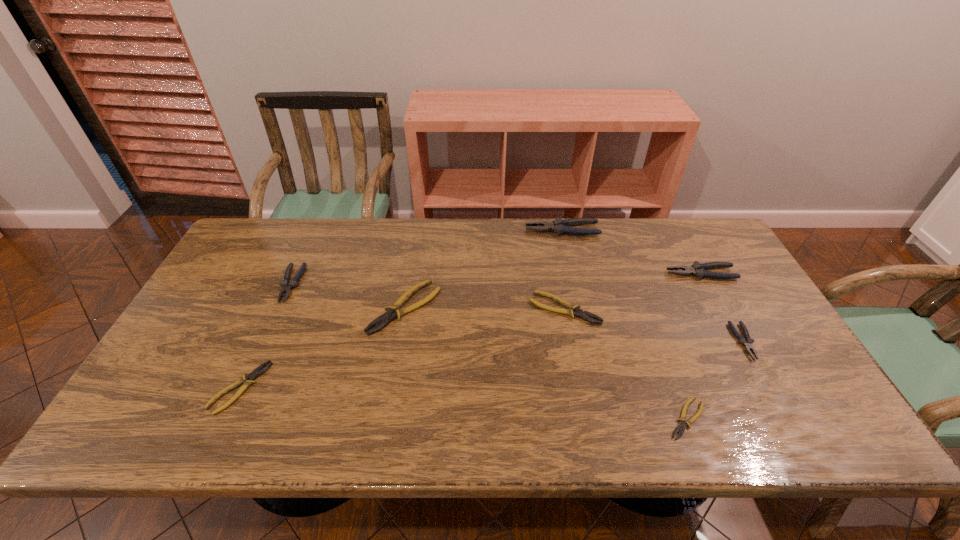
You are a GUI agent. You are given a task and a screenshot of the screen. Output one action in this format:
    pyautogui.click(x=<x>, y=<y>)
    Task: Click on the blank area at the far right corner
    The width and height of the screenshot is (960, 540).
    Given the screenshot: What is the action you would take?
    pyautogui.click(x=700, y=251)

Where is `free space that is in between the second yellow pliers from left to right and the leftmost gray pliers`? free space that is in between the second yellow pliers from left to right and the leftmost gray pliers is located at coordinates (348, 296).

The height and width of the screenshot is (540, 960). Find the location of `empty space between the second smallest gray pliers and the seventh shortest object`. empty space between the second smallest gray pliers and the seventh shortest object is located at coordinates (496, 279).

Identify the location of empty space between the third object from left to right and the seventh shortest object. The width and height of the screenshot is (960, 540). (553, 291).

Where is `vacant space that is in between the third smallest yellow pliers and the third yellow pliers from right to left`? vacant space that is in between the third smallest yellow pliers and the third yellow pliers from right to left is located at coordinates (485, 308).

Locate an element on the screen. This screenshot has height=540, width=960. free space that is in between the farthest gray pliers and the nearest gray pliers is located at coordinates (653, 286).

The height and width of the screenshot is (540, 960). In order to click on blank region between the shortest object and the seventh tallest object in this screenshot , I will do pos(464,403).

At what (x,y) coordinates should I click in order to perform the action: click on unoccupied position between the second yellow pliers from right to left and the smallest gray pliers. Please return your answer as a coordinate pair (x, y). The image size is (960, 540). Looking at the image, I should click on (654, 325).

Image resolution: width=960 pixels, height=540 pixels. I want to click on free space between the sixth pliers from right to left and the smallest yellow pliers, so click(546, 363).

This screenshot has width=960, height=540. Find the location of `vacant space that's between the farthest object and the third biggest gray pliers`. vacant space that's between the farthest object and the third biggest gray pliers is located at coordinates (426, 257).